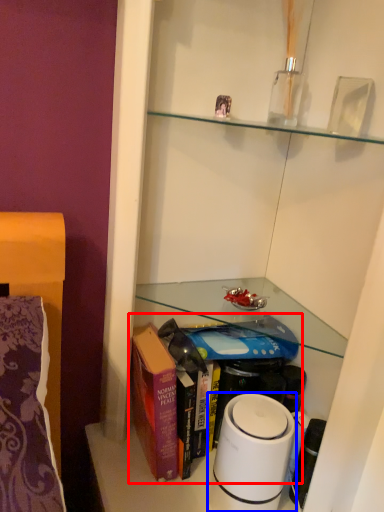
Question: Which point is further to the camera, book (highlighted by a red box) or home appliance (highlighted by a blue box)?

Choices:
 (A) book
 (B) home appliance

Answer: (A)